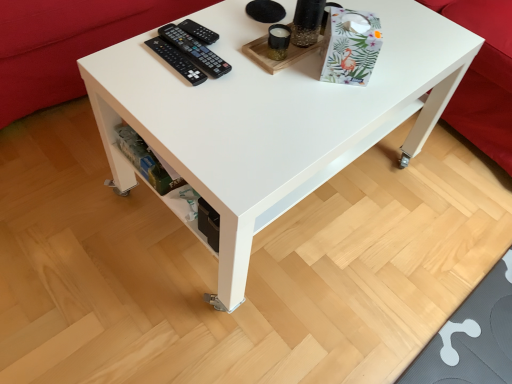
Question: Based on their sizes in the image, would you say black plastic remote at upper center, which ranks as the second control in bottom-to-top order, is bigger or smaller than black plastic remote controls at upper left, marked as the 1th control in a bottom-to-top arrangement?

Choices:
 (A) big
 (B) small

Answer: (B)

Question: Does point (218, 36) appear closer or farther from the camera than point (173, 31)?

Choices:
 (A) closer
 (B) farther

Answer: (B)

Question: Estimate the real-world distances between objects in this image. Which object is closer to the red fabric couch at lower left, the 2th couch viewed from the right?

Choices:
 (A) white glossy table at center
 (B) black plastic remote controls at upper left, marked as the 1th control in a bottom-to-top arrangement
 (C) black plastic remote at upper center, positioned as the 1th control in top-to-bottom order
 (D) red fabric couch at upper right, the 1th couch viewed from the right

Answer: (B)

Question: Estimate the real-world distances between objects in this image. Which object is closer to the black plastic remote at upper center, positioned as the 1th control in top-to-bottom order?

Choices:
 (A) white glossy table at center
 (B) black plastic remote controls at upper left, marked as the 1th control in a bottom-to-top arrangement
 (C) red fabric couch at lower left, the 2th couch viewed from the right
 (D) red fabric couch at upper right, acting as the 2th couch starting from the left

Answer: (B)